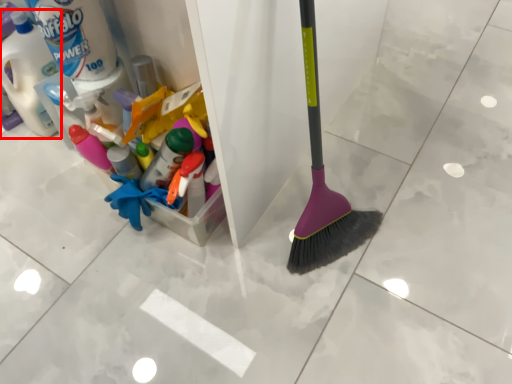
Question: Considering the relative positions of bottle (annotated by the red box) and cleaning product in the image provided, where is bottle (annotated by the red box) located with respect to the staircase?

Choices:
 (A) left
 (B) right

Answer: (A)